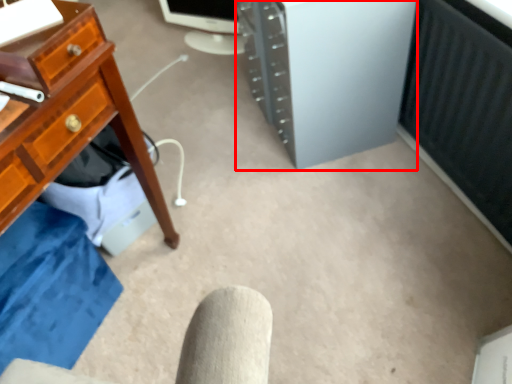
Question: In this image, where is computer tower (annotated by the red box) located relative to desktop computer?

Choices:
 (A) left
 (B) right

Answer: (B)